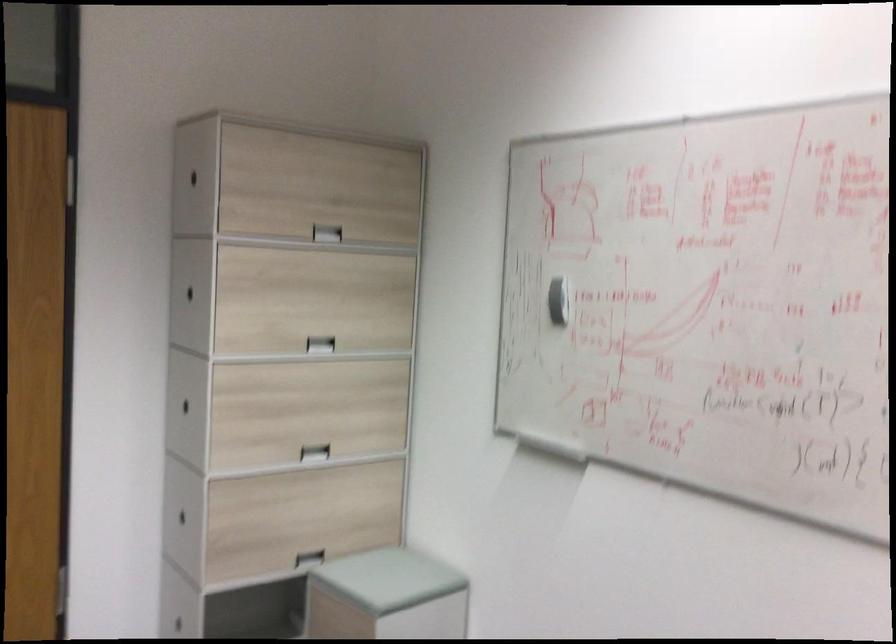
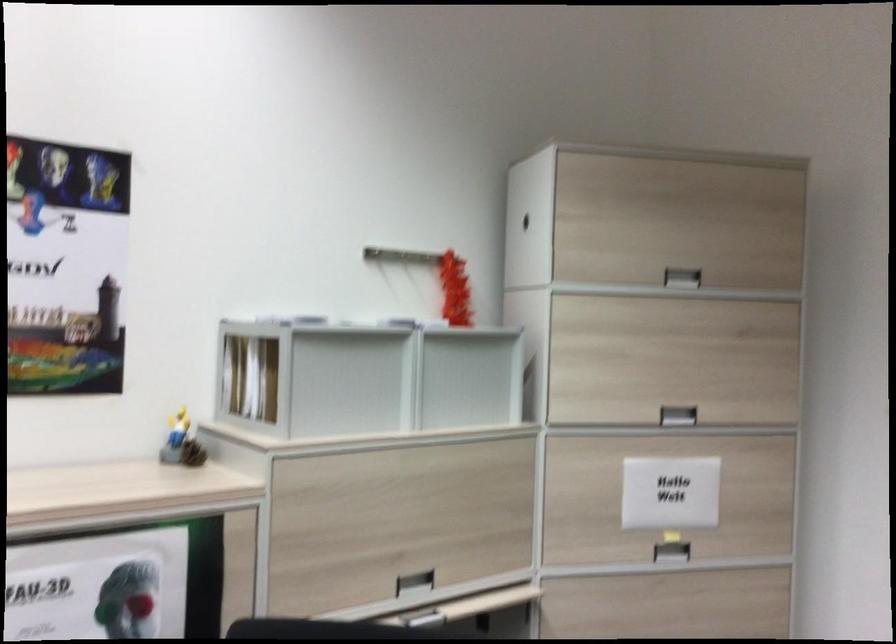
Question: How did the camera likely rotate?

Choices:
 (A) Left
 (B) Right
 (C) Up
 (D) Down

Answer: (A)